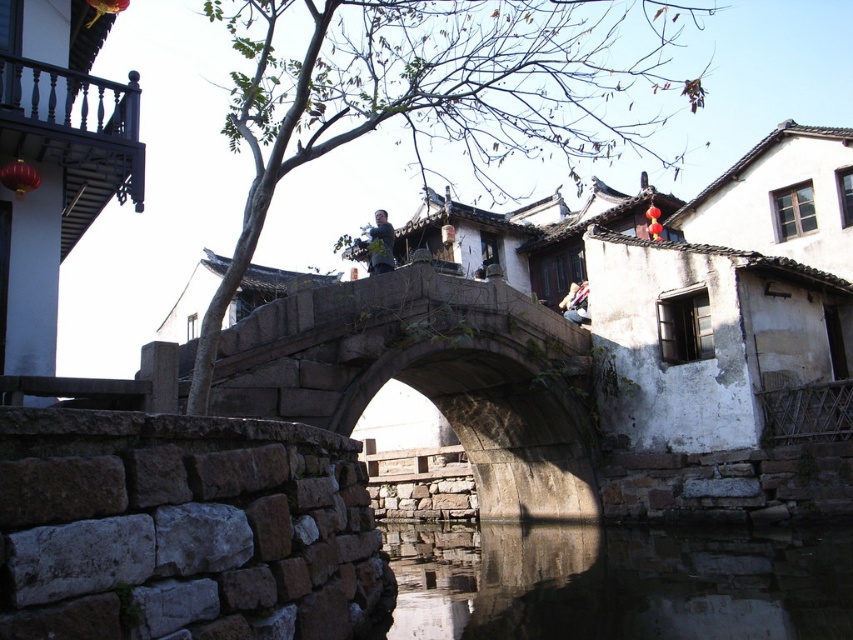
Question: Where is stone bridge at center located in relation to matte gray statue at center in the image?

Choices:
 (A) above
 (B) below

Answer: (B)

Question: Is the position of stone bridge at center more distant than that of light blue denim jacket at upper center?

Choices:
 (A) no
 (B) yes

Answer: (A)

Question: Is smooth stone water at center above matte gray statue at center?

Choices:
 (A) yes
 (B) no

Answer: (B)

Question: Estimate the real-world distances between objects in this image. Which object is farther from the light blue denim jacket at upper center?

Choices:
 (A) stone bridge at center
 (B) matte gray statue at center
 (C) smooth stone water at center

Answer: (C)

Question: Which point is farther to the camera?

Choices:
 (A) smooth stone water at center
 (B) matte gray statue at center
 (C) light blue denim jacket at upper center
 (D) stone bridge at center

Answer: (C)

Question: Which is farther from the smooth stone water at center?

Choices:
 (A) stone bridge at center
 (B) matte gray statue at center
 (C) light blue denim jacket at upper center

Answer: (B)